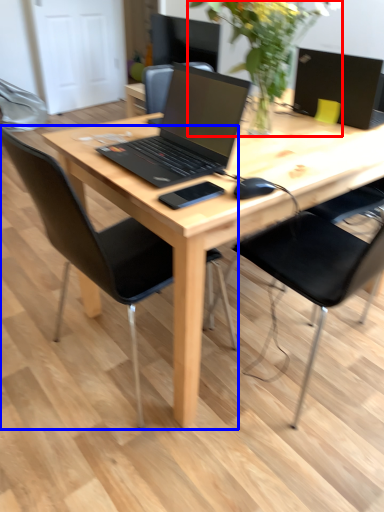
Question: Which point is further to the camera, floral arrangement (highlighted by a red box) or chair (highlighted by a blue box)?

Choices:
 (A) floral arrangement
 (B) chair

Answer: (A)